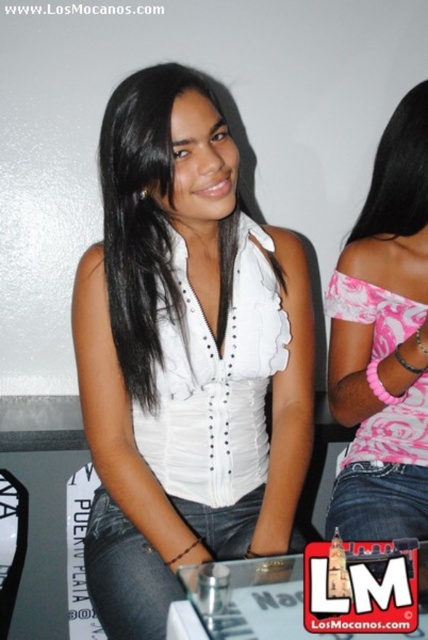
Question: In this image, where is jeans at center located relative to black smooth hair at upper right?

Choices:
 (A) left
 (B) right

Answer: (A)

Question: Which object is positioned farthest from the jeans at center?

Choices:
 (A) white satin blouse at center
 (B) jeans at lower right

Answer: (B)

Question: Observing the image, what is the correct spatial positioning of white satin blouse at center in reference to black smooth hair at upper right?

Choices:
 (A) right
 (B) left

Answer: (B)

Question: Considering the real-world distances, which object is closest to the jeans at center?

Choices:
 (A) pink paisley fabric top at upper right
 (B) black smooth hair at upper right
 (C) white satin blouse at center
 (D) jeans at lower right

Answer: (C)

Question: Does pink paisley fabric top at upper right have a greater width compared to black smooth hair at upper right?

Choices:
 (A) yes
 (B) no

Answer: (A)

Question: Which object appears farthest from the camera in this image?

Choices:
 (A) jeans at lower right
 (B) jeans at center
 (C) pink paisley fabric top at upper right
 (D) white satin blouse at center

Answer: (A)